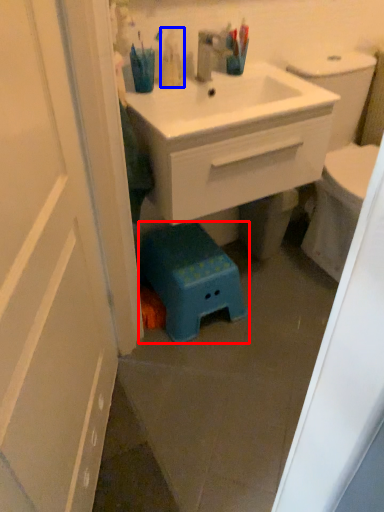
Question: Among these objects, which one is farthest to the camera, step stool (highlighted by a red box) or toiletry (highlighted by a blue box)?

Choices:
 (A) step stool
 (B) toiletry

Answer: (A)